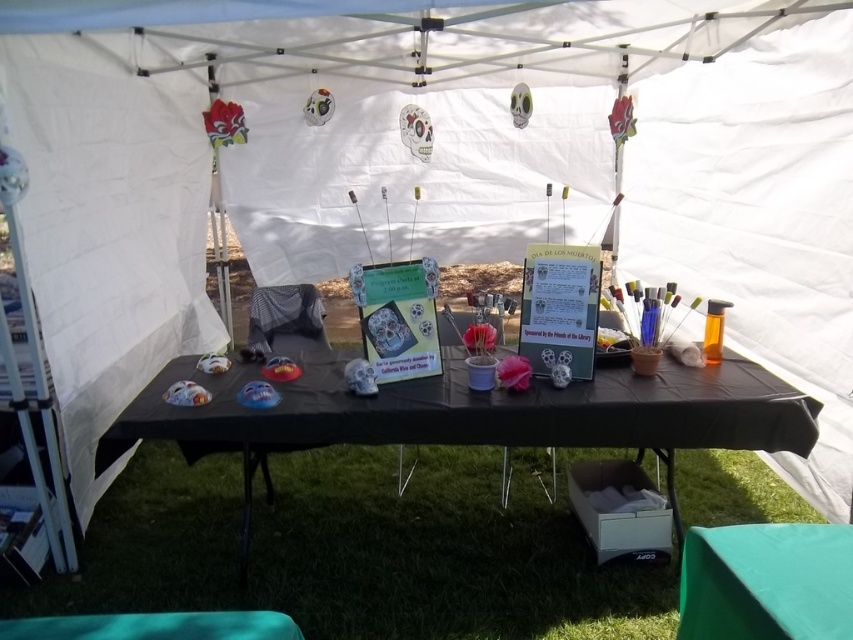
Which of these two, green grass at lower center or black matte picnic table at center, stands shorter?

green grass at lower center is shorter.

Which is more to the right, green grass at lower center or black matte picnic table at center?

Positioned to the right is black matte picnic table at center.

Who is more distant from viewer, (x=384, y=476) or (x=750, y=426)?

The point (x=384, y=476) is behind.

Identify the location of green grass at lower center. This screenshot has height=640, width=853. (358, 548).